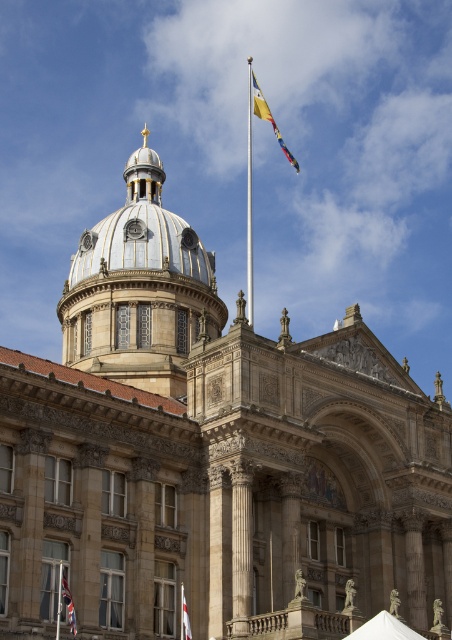
You are standing in front of the grand building and notice two points marked on the structure. The first point is located at coordinates point (296, 172) and the second at point (73, 621). Which of these points is closer to you?

Point (296, 172) is closer to you since it is further to the viewer than point (73, 621).

You are a visitor standing in front of the grand building. You notice two flags flying. The multicolored fabric flag at upper center and the white fabric flag at lower center. Which flag is taller?

The multicolored fabric flag at upper center is much taller than the white fabric flag at lower center.